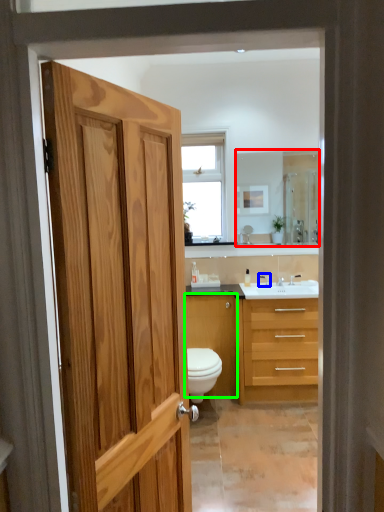
Question: Considering the real-world distances, which object is closest to mirror (highlighted by a red box)? faucet (highlighted by a blue box) or cabinetry (highlighted by a green box).

Choices:
 (A) faucet
 (B) cabinetry

Answer: (A)